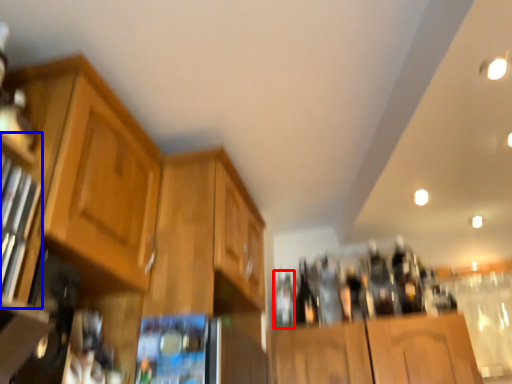
Question: Which object is further to the camera taking this photo, bottle (highlighted by a red box) or shelf (highlighted by a blue box)?

Choices:
 (A) bottle
 (B) shelf

Answer: (A)